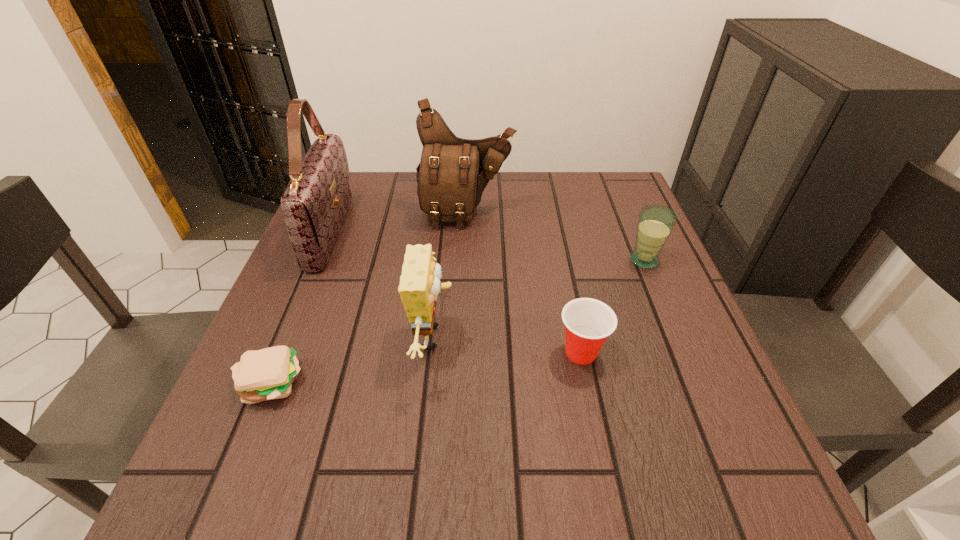
Locate an element on the screen. Image resolution: width=960 pixels, height=540 pixels. vacant space that satisfies the following two spatial constraints: 1. on the front of the handbag with the clasp; 2. on the left side of the rightmost object is located at coordinates (319, 260).

This screenshot has width=960, height=540. I want to click on free location that satisfies the following two spatial constraints: 1. on the face of the third tallest object; 2. on the left side of the second object from right to left, so click(x=433, y=353).

Identify the location of vacant space that satisfies the following two spatial constraints: 1. on the front of the handbag with the clasp; 2. on the left side of the glass. (319, 260).

The height and width of the screenshot is (540, 960). Identify the location of blank space that satisfies the following two spatial constraints: 1. on the front-facing side of the third shortest object; 2. on the right side of the fifth shortest object. (465, 260).

Identify the location of vacant space that satisfies the following two spatial constraints: 1. on the front side of the rightmost object; 2. on the face of the fourth shortest object. (676, 337).

This screenshot has height=540, width=960. Find the location of `free space that satisfies the following two spatial constraints: 1. on the front of the handbag with the clasp; 2. on the right side of the glass`. free space that satisfies the following two spatial constraints: 1. on the front of the handbag with the clasp; 2. on the right side of the glass is located at coordinates (319, 260).

Locate an element on the screen. The width and height of the screenshot is (960, 540). free space that satisfies the following two spatial constraints: 1. on the front-facing side of the second tallest object; 2. on the face of the fourth shortest object is located at coordinates (462, 337).